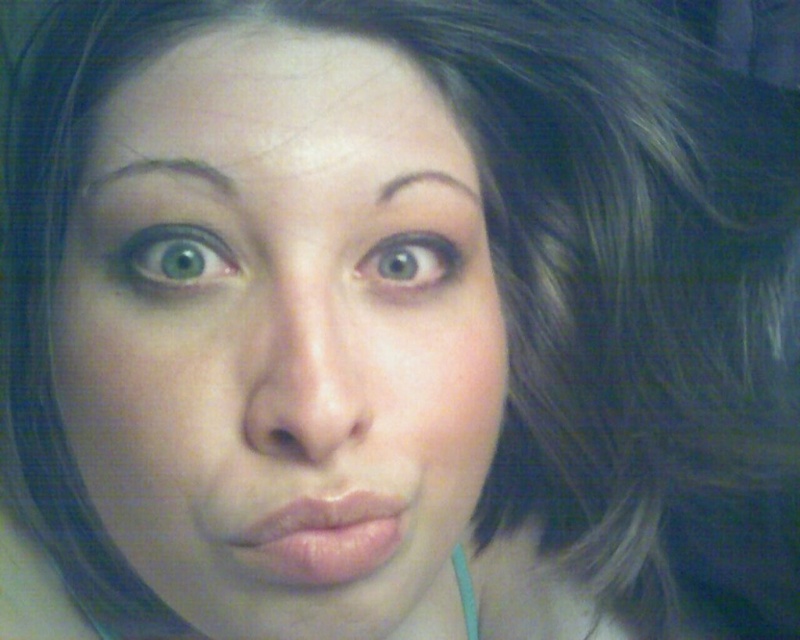
Question: Is the position of pink glossy lips at center more distant than that of dark brown hair at upper center?

Choices:
 (A) yes
 (B) no

Answer: (B)

Question: Which object is closer to the camera taking this photo?

Choices:
 (A) brown matte eyebrow at upper center
 (B) pink glossy lips at center
 (C) green matte eye at upper left

Answer: (B)

Question: Which point is farther to the camera?

Choices:
 (A) (182, 161)
 (B) (336, 513)
 (C) (294, 179)
 (D) (378, 262)

Answer: (D)

Question: Estimate the real-world distances between objects in this image. Which object is closer to the smooth skin face at center?

Choices:
 (A) green matte eye at upper left
 (B) pink glossy lips at center
 (C) brown matte eyebrow at upper center

Answer: (A)

Question: Does pink glossy lips at center have a larger size compared to green matte eye at upper center?

Choices:
 (A) no
 (B) yes

Answer: (B)

Question: Is pink glossy lips at center below green matte eye at upper left?

Choices:
 (A) yes
 (B) no

Answer: (A)